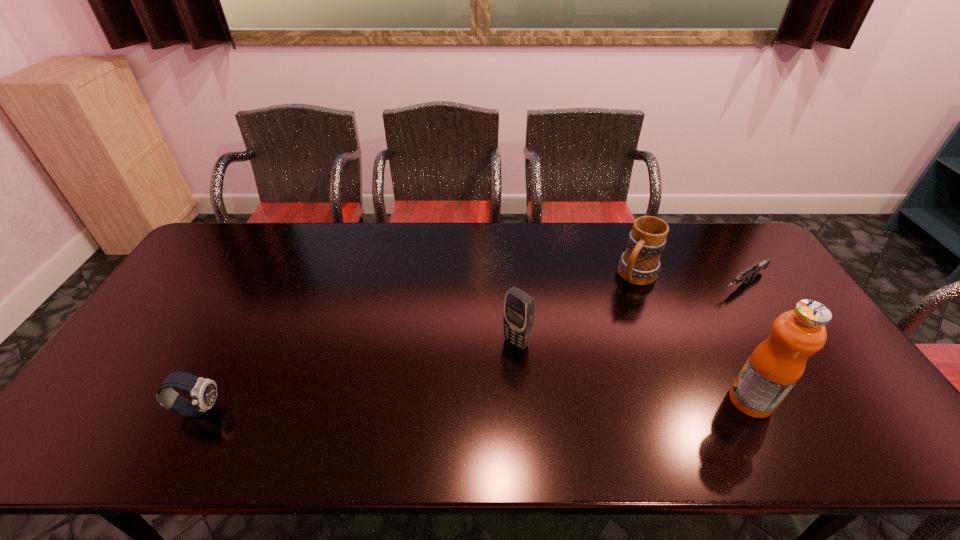
Locate an element on the screen. The height and width of the screenshot is (540, 960). vacant space in between the watch and the second object from left to right is located at coordinates (357, 376).

Where is `empty location between the third farthest object and the fourth object from left to right`? Image resolution: width=960 pixels, height=540 pixels. empty location between the third farthest object and the fourth object from left to right is located at coordinates (634, 372).

Find the location of `vacant area that lies between the rightmost object and the leftmost object`. vacant area that lies between the rightmost object and the leftmost object is located at coordinates (470, 347).

Image resolution: width=960 pixels, height=540 pixels. I want to click on free space between the second shortest object and the shortest object, so click(470, 347).

You are a GUI agent. You are given a task and a screenshot of the screen. Output one action in this format:
    pyautogui.click(x=<x>, y=<y>)
    Task: Click on the vacant point located between the mug and the third nearest object
    The width and height of the screenshot is (960, 540).
    Given the screenshot: What is the action you would take?
    pyautogui.click(x=576, y=309)

Where is `free space between the gun and the leftmost object`? The width and height of the screenshot is (960, 540). free space between the gun and the leftmost object is located at coordinates (470, 347).

Where is `vacant region between the fruit juice and the watch`? The height and width of the screenshot is (540, 960). vacant region between the fruit juice and the watch is located at coordinates (474, 405).

The height and width of the screenshot is (540, 960). Find the location of `free space between the third nearest object and the fourth tallest object`. free space between the third nearest object and the fourth tallest object is located at coordinates (357, 376).

Image resolution: width=960 pixels, height=540 pixels. In order to click on vacant area that lies between the gun and the second shortest object in this screenshot , I will do `click(470, 347)`.

The image size is (960, 540). What are the coordinates of `free spot between the second object from left to right and the fourth tallest object` in the screenshot? It's located at (357, 376).